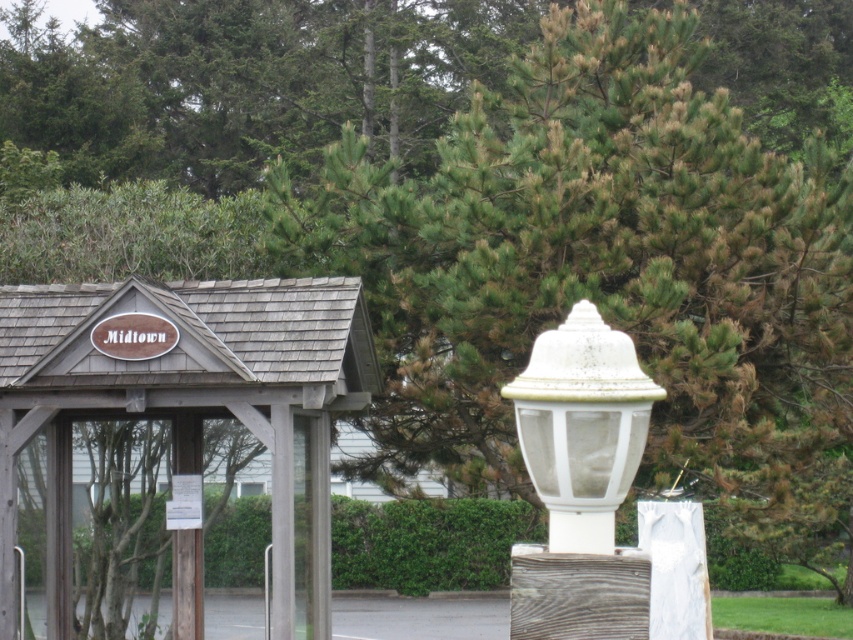
Looking at this image, which is above, wooden sign at center or white matte lamp post at center?

white matte lamp post at center is higher up.

At what (x,y) coordinates should I click in order to perform the action: click on wooden sign at center. Please return your answer as a coordinate pair (x, y). The width and height of the screenshot is (853, 640). Looking at the image, I should click on (167, 444).